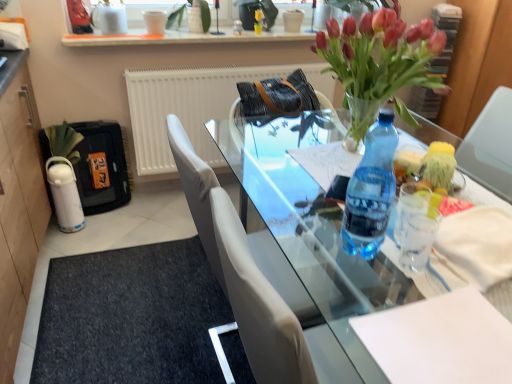
Question: From a real-world perspective, is leather at center physically above white matte radiator at upper center?

Choices:
 (A) no
 (B) yes

Answer: (B)

Question: Is leather at center positioned before white matte radiator at upper center?

Choices:
 (A) no
 (B) yes

Answer: (B)

Question: Is leather at center aimed at white matte radiator at upper center?

Choices:
 (A) no
 (B) yes

Answer: (A)

Question: Is leather at center far away from white matte radiator at upper center?

Choices:
 (A) no
 (B) yes

Answer: (A)

Question: Is leather at center outside white matte radiator at upper center?

Choices:
 (A) no
 (B) yes

Answer: (B)

Question: From the image's perspective, is blue translucent bottle at right located above or below transparent glass table at center?

Choices:
 (A) below
 (B) above

Answer: (B)

Question: Would you say blue translucent bottle at right is to the left or to the right of transparent glass table at center in the picture?

Choices:
 (A) left
 (B) right

Answer: (A)

Question: Looking at their shapes, would you say blue translucent bottle at right is wider or thinner than transparent glass table at center?

Choices:
 (A) thin
 (B) wide

Answer: (A)

Question: Is blue translucent bottle at right bigger or smaller than transparent glass table at center?

Choices:
 (A) big
 (B) small

Answer: (B)

Question: Is white glossy shelf at upper center in front of or behind white plastic corded phone at upper left in the image?

Choices:
 (A) front
 (B) behind

Answer: (B)

Question: From a real-world perspective, is white glossy shelf at upper center positioned above or below white plastic corded phone at upper left?

Choices:
 (A) above
 (B) below

Answer: (B)

Question: Would you say white glossy shelf at upper center is inside or outside white plastic corded phone at upper left?

Choices:
 (A) inside
 (B) outside

Answer: (B)

Question: From the image's perspective, is white glossy shelf at upper center positioned above or below white plastic corded phone at upper left?

Choices:
 (A) below
 (B) above

Answer: (B)

Question: Do you think black rubber doormat at lower left is within leather at center, or outside of it?

Choices:
 (A) outside
 (B) inside

Answer: (A)

Question: Considering the relative positions of black rubber doormat at lower left and leather at center in the image provided, is black rubber doormat at lower left to the left or to the right of leather at center?

Choices:
 (A) left
 (B) right

Answer: (A)